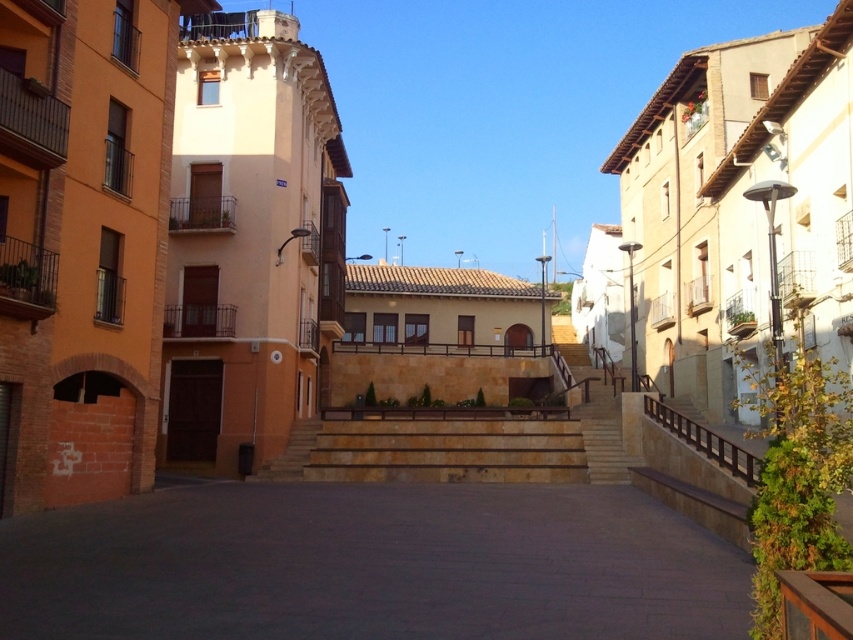
Question: Which point is closer to the camera?

Choices:
 (A) natural stone stairs at center
 (B) brown wooden rail at right
 (C) beige stone stairs at center
 (D) dark gray concrete alley at center

Answer: (D)

Question: Which object is closer to the camera taking this photo?

Choices:
 (A) natural stone stairs at center
 (B) beige stone stairs at center
 (C) dark gray concrete alley at center

Answer: (C)

Question: Does beige stone stairs at center appear under brown wooden rail at right?

Choices:
 (A) yes
 (B) no

Answer: (B)

Question: Does beige stone stairs at center appear on the left side of brown wooden rail at right?

Choices:
 (A) no
 (B) yes

Answer: (A)

Question: Observing the image, what is the correct spatial positioning of natural stone stairs at center in reference to brown wooden rail at right?

Choices:
 (A) below
 (B) above

Answer: (A)

Question: Which point is farther to the camera?

Choices:
 (A) brown wooden rail at right
 (B) natural stone stairs at center

Answer: (B)